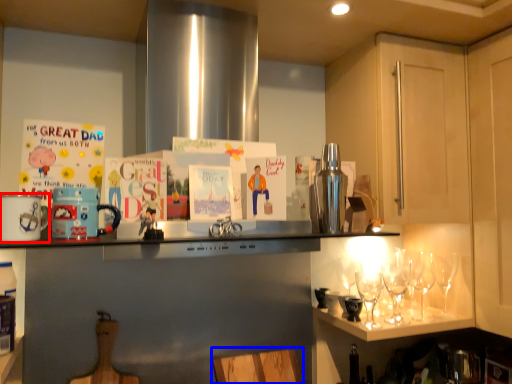
Question: Which point is further to the camera, appliance (highlighted by a red box) or chair (highlighted by a blue box)?

Choices:
 (A) appliance
 (B) chair

Answer: (B)